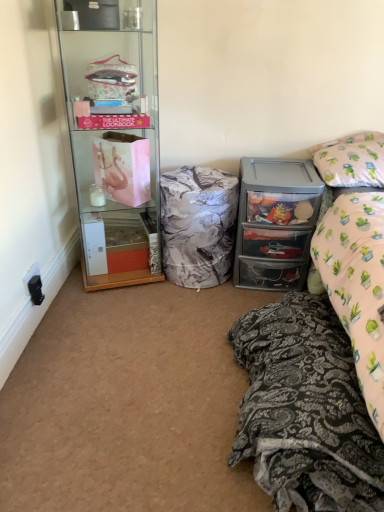
This screenshot has width=384, height=512. I want to click on free area in between clear glass cabinet at left and marble-patterned fabric at center, so click(153, 292).